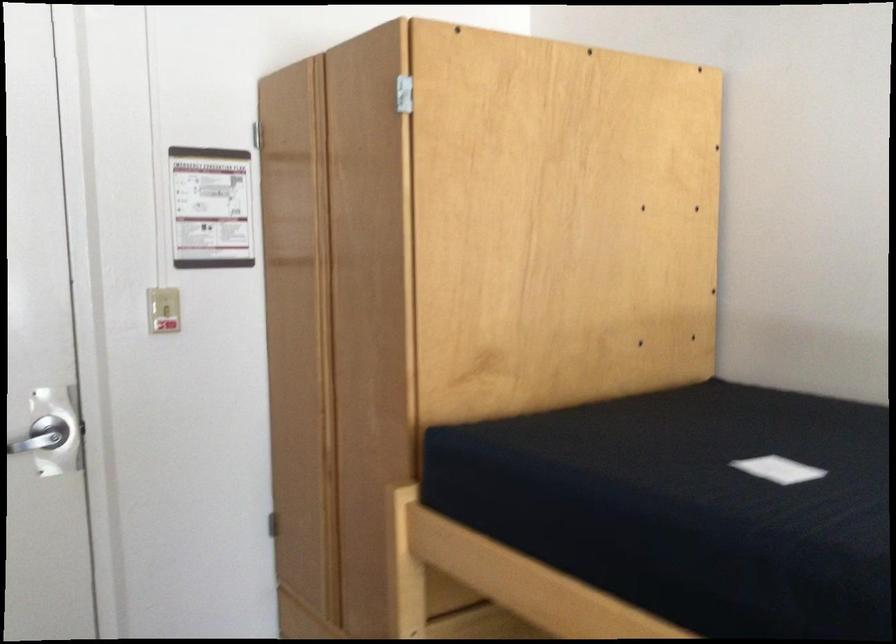
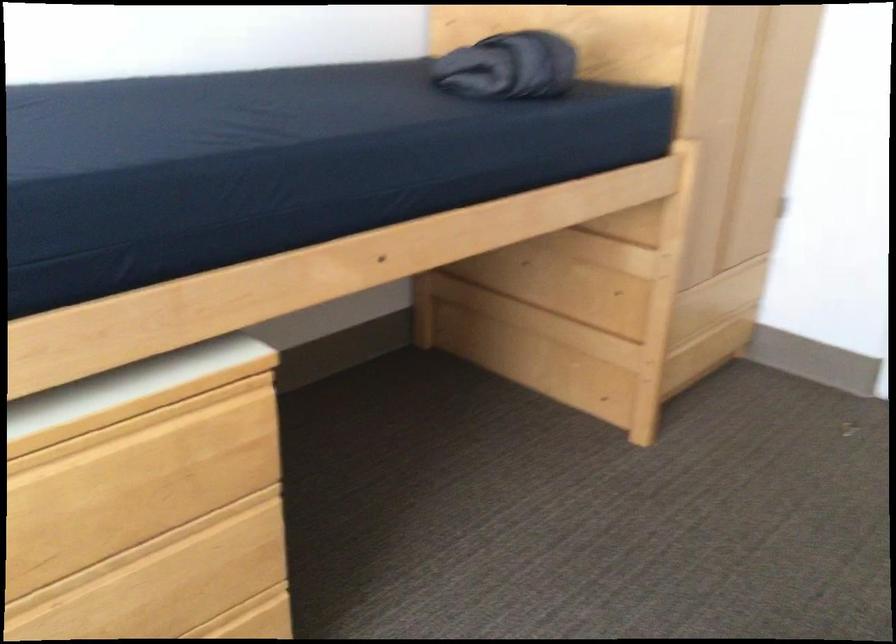
The first image is from the beginning of the video and the second image is from the end. How did the camera likely rotate when shooting the video?

The camera rotated toward left-down.